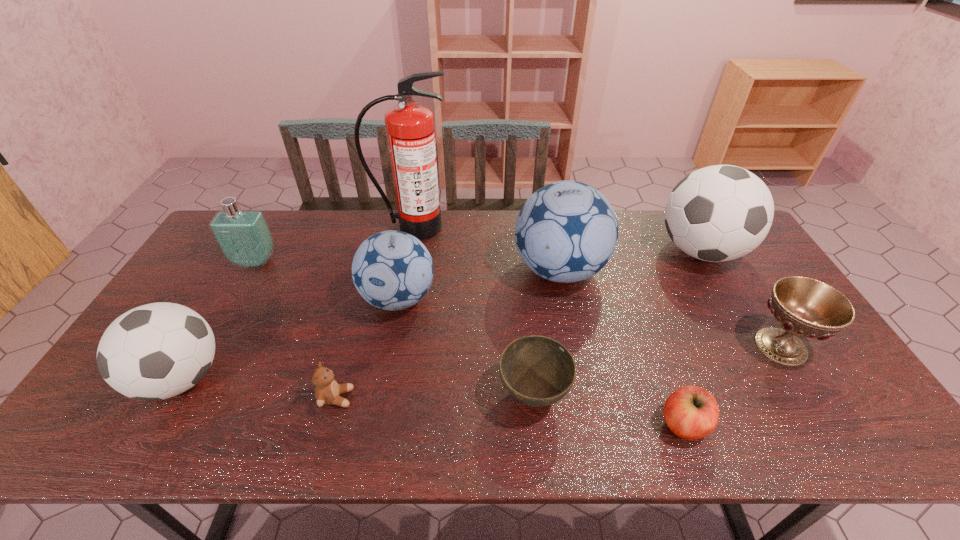
Identify the location of vacant area at the near edge of the desktop. pos(666,445).

Identify the location of vacant position at the right edge of the desktop. (819, 407).

Identify the location of free space at the near left corner. The height and width of the screenshot is (540, 960). (110, 417).

Image resolution: width=960 pixels, height=540 pixels. I want to click on vacant area at the near right corner, so click(x=866, y=413).

Image resolution: width=960 pixels, height=540 pixels. Find the location of `free point between the third object from right to left and the brown bowl`. free point between the third object from right to left and the brown bowl is located at coordinates (609, 409).

I want to click on vacant region between the brown bowl and the farther black soccer ball, so click(x=617, y=323).

Locate an element on the screen. The height and width of the screenshot is (540, 960). empty space that is in between the right blue soccer ball and the tallest object is located at coordinates (486, 248).

This screenshot has height=540, width=960. I want to click on vacant region between the apple and the nearest soccer ball, so click(432, 401).

You are a GUI agent. You are given a task and a screenshot of the screen. Output one action in this format:
    pyautogui.click(x=<x>, y=<y>)
    Task: Click on the blank region between the seventh tallest object and the perfume
    Image resolution: width=960 pixels, height=540 pixels.
    Given the screenshot: What is the action you would take?
    pyautogui.click(x=517, y=304)

Locate an element on the screen. This screenshot has width=960, height=540. free space between the left black soccer ball and the brown teddy bear is located at coordinates (259, 388).